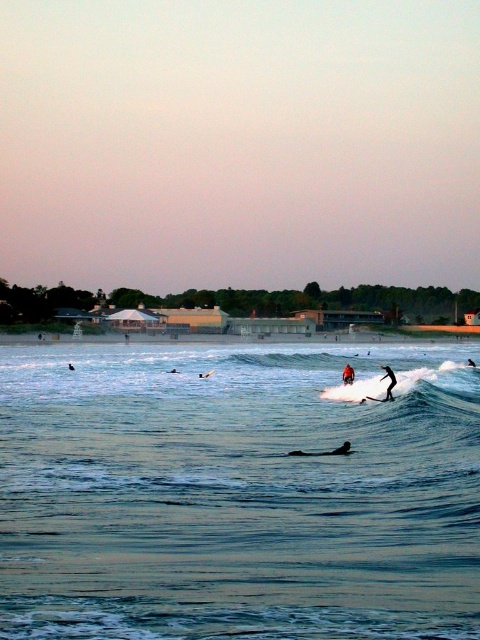
Question: Can you confirm if white foam surfboard at center is bigger than black matte surfboard at center?

Choices:
 (A) yes
 (B) no

Answer: (B)

Question: Which object is closer to the camera taking this photo?

Choices:
 (A) clear blue water at center
 (B) orange wetsuit surfer at center
 (C) black matte wetsuit at center

Answer: (A)

Question: Does white foam surfboard at center have a larger size compared to black wetsuit surfer at center?

Choices:
 (A) yes
 (B) no

Answer: (B)

Question: Which point is closer to the camera?

Choices:
 (A) (342, 451)
 (B) (474, 364)
 (C) (350, 372)
 (D) (381, 380)

Answer: (A)

Question: Among these objects, which one is farthest from the camera?

Choices:
 (A) dark blue wetsuit at center
 (B) clear blue water at center

Answer: (A)

Question: Does dark blue wetsuit at center appear over white foam surfboard at center?

Choices:
 (A) yes
 (B) no

Answer: (B)